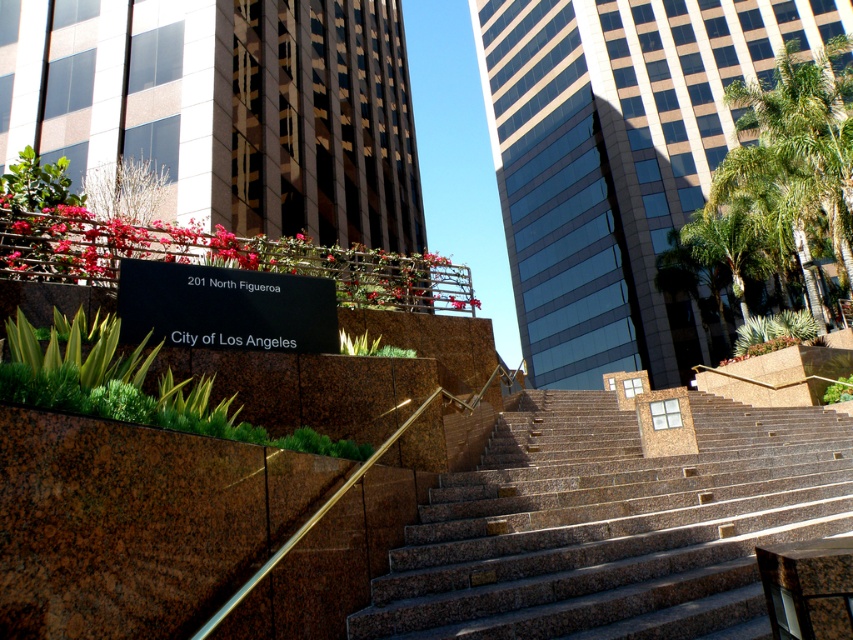
You are a delivery person carrying a large box that is 1.2 meters wide. You need to walk up the brown granite stairs at center. Can you fit through the space between the stairs and the green leafy palm tree at upper right?

The brown granite stairs at center are narrower than the green leafy palm tree at upper right. Since the stairs are narrower, the space between them and the palm tree may be too narrow for your 1.2 meter wide box. You should check the exact width before proceeding.

You are standing at the entrance of the building and want to locate the brown granite stairs at center. According to the coordinates provided, where exactly should you look to find them?

The brown granite stairs at center are located at coordinates point (613, 524).

You are standing at the bottom of the wide stone stairs leading to the building entrance. You see two points marked on the scene. The first point is at coordinate point (701, 552) and the second is at point (776, 140). If you want to reach the point that is closer to you, which coordinate should you head towards?

Point (701, 552) is in front of point (776, 140), so the point closer to you is point (701, 552).